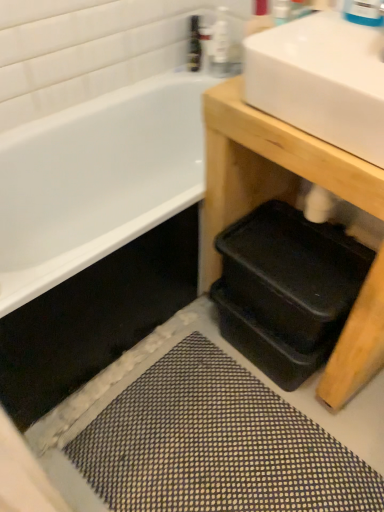
Question: Should I look upward or downward to see clear plastic bottle at upper center, which is the second toiletry from left to right?

Choices:
 (A) up
 (B) down

Answer: (A)

Question: From a real-world perspective, is textured gray bath mat at lower center positioned over clear plastic bottle at upper center, which is the second toiletry from left to right, based on gravity?

Choices:
 (A) yes
 (B) no

Answer: (B)

Question: Can you confirm if textured gray bath mat at lower center is thinner than clear plastic bottle at upper center, which is the second toiletry from left to right?

Choices:
 (A) yes
 (B) no

Answer: (B)

Question: Is textured gray bath mat at lower center further to the viewer compared to clear plastic bottle at upper center, which is the second toiletry from left to right?

Choices:
 (A) no
 (B) yes

Answer: (A)

Question: Is textured gray bath mat at lower center oriented towards clear plastic bottle at upper center, arranged as the 1th toiletry when viewed from the right?

Choices:
 (A) yes
 (B) no

Answer: (B)

Question: Is the surface of textured gray bath mat at lower center in direct contact with clear plastic bottle at upper center, arranged as the 1th toiletry when viewed from the right?

Choices:
 (A) yes
 (B) no

Answer: (B)

Question: Considering the relative sizes of textured gray bath mat at lower center and clear plastic bottle at upper center, arranged as the 1th toiletry when viewed from the right, in the image provided, is textured gray bath mat at lower center taller than clear plastic bottle at upper center, arranged as the 1th toiletry when viewed from the right,?

Choices:
 (A) yes
 (B) no

Answer: (B)

Question: From a real-world perspective, is white glossy sink at upper right physically above textured gray bath mat at lower center?

Choices:
 (A) yes
 (B) no

Answer: (A)

Question: Is white glossy sink at upper right smaller than textured gray bath mat at lower center?

Choices:
 (A) no
 (B) yes

Answer: (A)

Question: Is white glossy sink at upper right to the right of textured gray bath mat at lower center from the viewer's perspective?

Choices:
 (A) yes
 (B) no

Answer: (A)

Question: Considering the relative positions of white glossy sink at upper right and textured gray bath mat at lower center in the image provided, is white glossy sink at upper right behind textured gray bath mat at lower center?

Choices:
 (A) no
 (B) yes

Answer: (A)

Question: Does white glossy sink at upper right have a greater height compared to textured gray bath mat at lower center?

Choices:
 (A) no
 (B) yes

Answer: (B)

Question: From the image's perspective, is white glossy sink at upper right on top of textured gray bath mat at lower center?

Choices:
 (A) no
 (B) yes

Answer: (B)

Question: Is black plastic trays at lower right at the left side of textured gray bath mat at lower center?

Choices:
 (A) yes
 (B) no

Answer: (B)